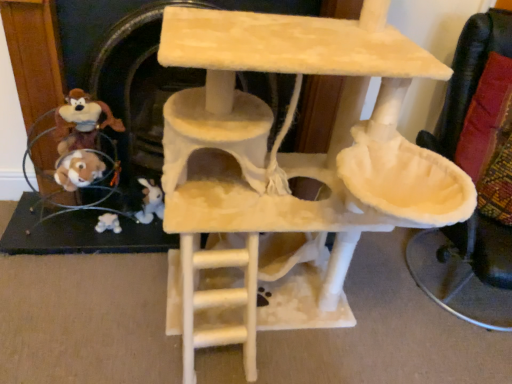
Question: Visually, is beige felt cat tree at center positioned to the left or to the right of white plush toy at lower left, which is the second toy in front-to-back order?

Choices:
 (A) right
 (B) left

Answer: (A)

Question: Considering the positions of beige felt cat tree at center and white plush toy at lower left, the 1th toy from the back, in the image, is beige felt cat tree at center bigger or smaller than white plush toy at lower left, the 1th toy from the back,?

Choices:
 (A) small
 (B) big

Answer: (B)

Question: Based on their relative distances, which object is farther from the beige felt fireplace at center?

Choices:
 (A) beige felt cat tree at center
 (B) velvet-like black armchair at right
 (C) white plush toy at lower left, which is the second toy in front-to-back order
 (D) brown plush toy at left, which is the first toy in top-to-bottom order

Answer: (B)

Question: Which object is the closest to the beige felt fireplace at center?

Choices:
 (A) white plush toy at lower left, the 1th toy from the back
 (B) velvet-like black armchair at right
 (C) beige felt cat tree at center
 (D) brown plush toy at left, which is the 1th toy in front-to-back order

Answer: (D)